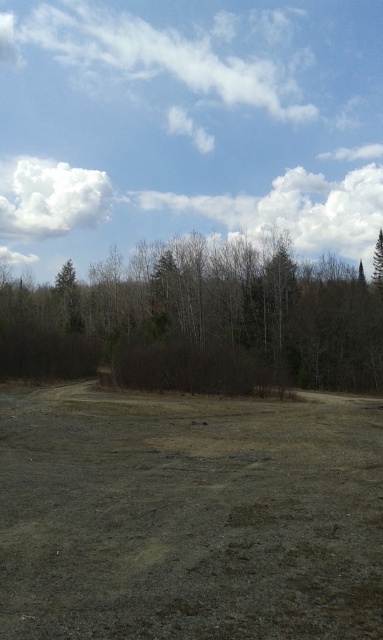
Does brown/dry soil at center appear under brown/dry bush at center?

Yes.

Who is taller, brown/dry soil at center or brown/dry bush at center?

brown/dry bush at center is taller.

Who is more forward, [183,536] or [350,276]?

Point [183,536] is in front.

What are the coordinates of `brown/dry soil at center` in the screenshot? It's located at (188, 516).